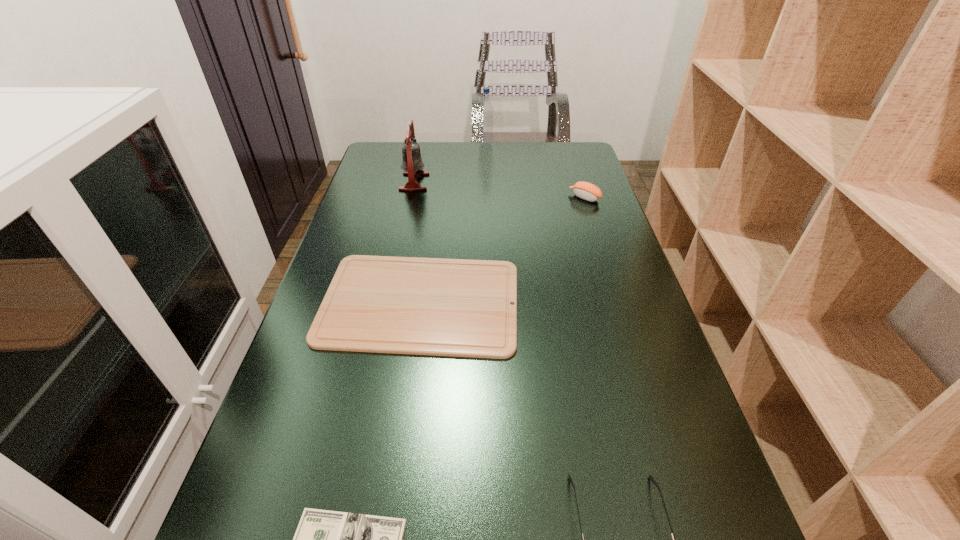
At what (x,y) coordinates should I click in order to perform the action: click on free space between the bell and the sushi. Please return your answer as a coordinate pair (x, y). Image resolution: width=960 pixels, height=540 pixels. Looking at the image, I should click on (499, 190).

Image resolution: width=960 pixels, height=540 pixels. What are the coordinates of `vacant space that's between the third tallest object and the farthest object` in the screenshot? It's located at (536, 171).

Locate an element on the screen. unoccupied position between the water bottle and the fourth shortest object is located at coordinates (536, 171).

At what (x,y) coordinates should I click in order to perform the action: click on free space between the sushi and the chopping board. Please return your answer as a coordinate pair (x, y). The image size is (960, 540). Looking at the image, I should click on (502, 250).

This screenshot has width=960, height=540. In order to click on object identified as the fifth closest to the sushi in this screenshot , I will do `click(324, 539)`.

Locate an element on the screen. Image resolution: width=960 pixels, height=540 pixels. the third closest object to the dollar is located at coordinates (412, 164).

Where is `free point that satisfies the following two spatial constraints: 1. on the front side of the bell; 2. on the right side of the fourth shortest object`? The width and height of the screenshot is (960, 540). free point that satisfies the following two spatial constraints: 1. on the front side of the bell; 2. on the right side of the fourth shortest object is located at coordinates (411, 198).